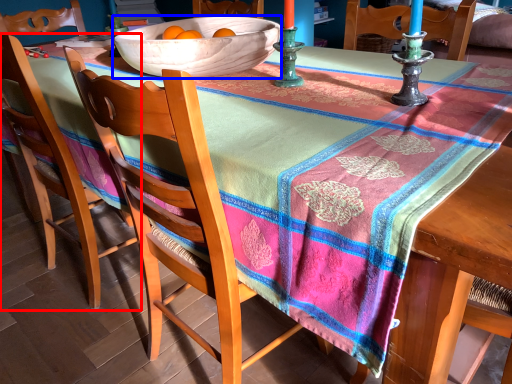
Question: Which object appears closest to the camera in this image, chair (highlighted by a red box) or bowl (highlighted by a blue box)?

Choices:
 (A) chair
 (B) bowl

Answer: (B)